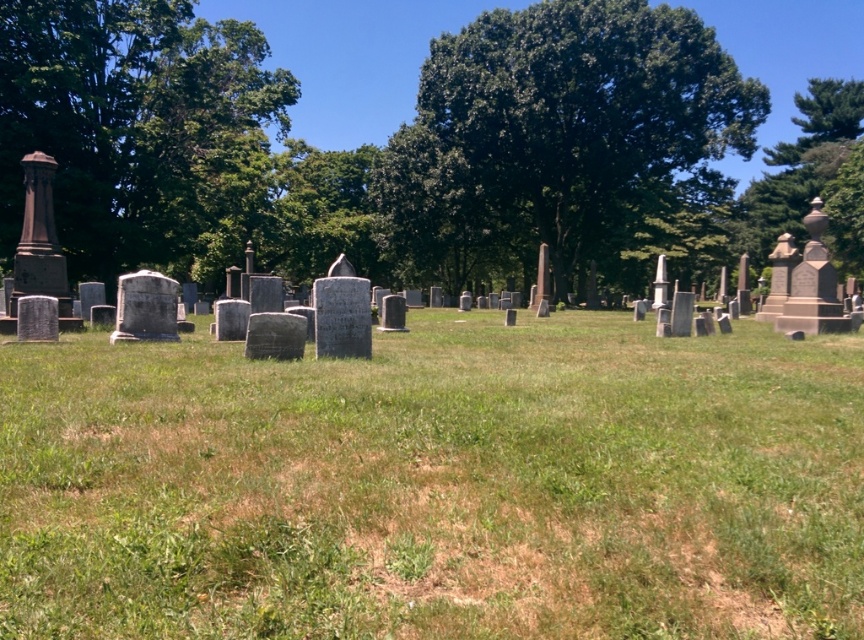
Which is behind, point (710, 180) or point (791, 147)?

Point (791, 147)

Between point (491, 195) and point (852, 109), which one is positioned in front?

Point (491, 195)

Does point (638, 154) come in front of point (786, 161)?

Yes, it is in front of point (786, 161).

Where is `green leafy tree at center`? This screenshot has height=640, width=864. green leafy tree at center is located at coordinates (560, 134).

Can you confirm if green grassy field at center is positioned to the right of green leafy tree at center?

In fact, green grassy field at center is to the left of green leafy tree at center.

At what (x,y) coordinates should I click in order to perform the action: click on green grassy field at center. Please return your answer as a coordinate pair (x, y). This screenshot has width=864, height=640. Looking at the image, I should click on (436, 484).

Locate an element on the screen. The width and height of the screenshot is (864, 640). green grassy field at center is located at coordinates (436, 484).

Does green grassy field at center appear over green leafy tree at upper right?

Actually, green grassy field at center is below green leafy tree at upper right.

Is green grassy field at center in front of green leafy tree at upper right?

Yes, green grassy field at center is in front of green leafy tree at upper right.

Locate an element on the screen. The height and width of the screenshot is (640, 864). green grassy field at center is located at coordinates coord(436,484).